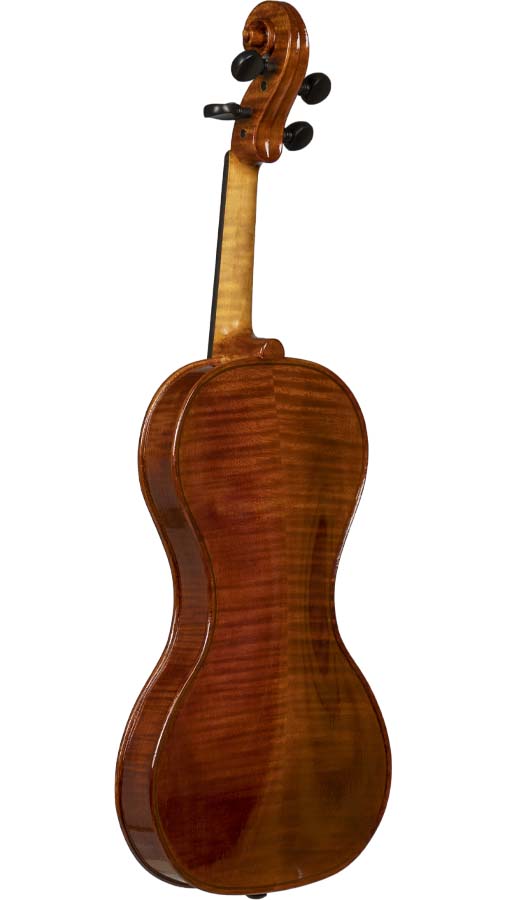
Image resolution: width=506 pixels, height=900 pixels. Find the location of `stand`. stand is located at coordinates (257, 896).